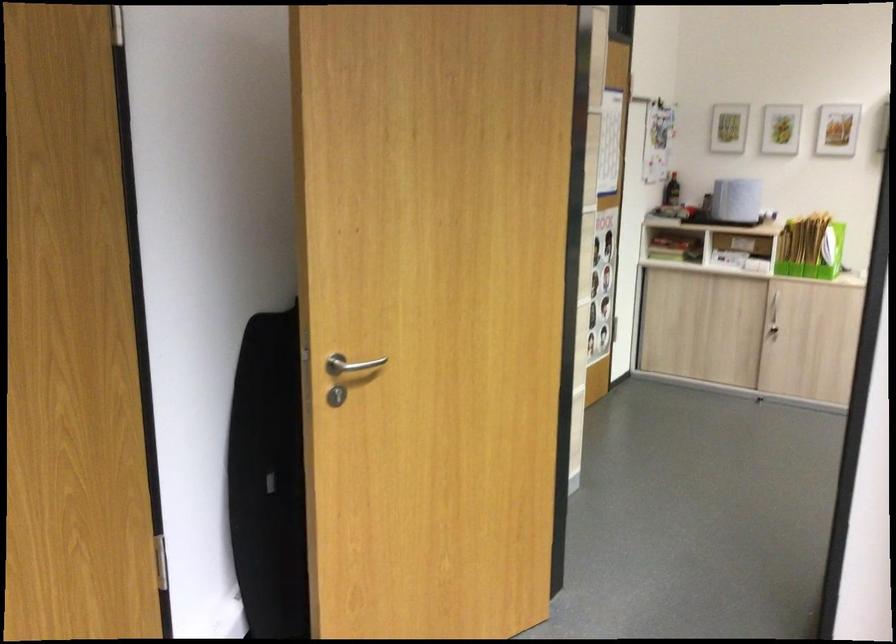
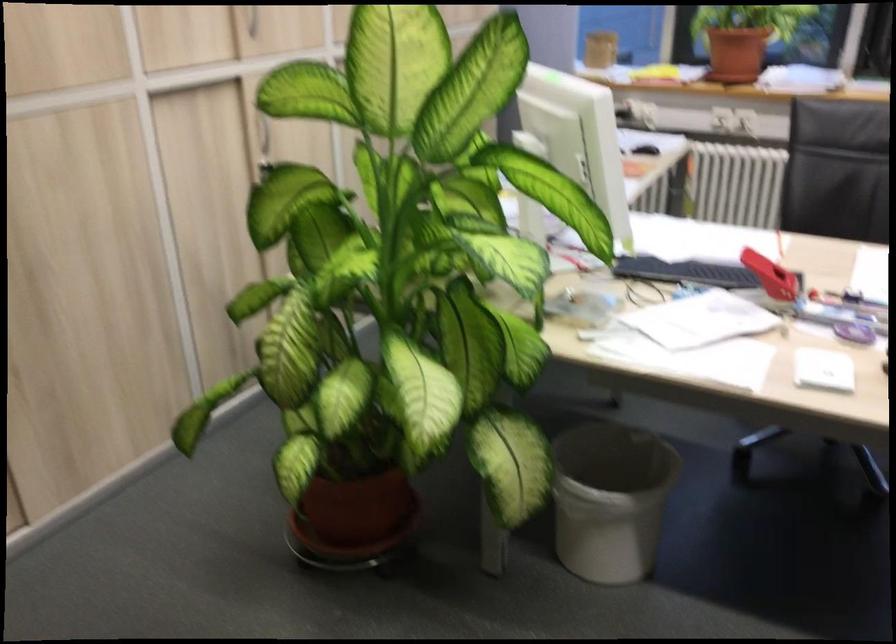
How did the camera likely rotate?

The camera's rotation is toward right-down.